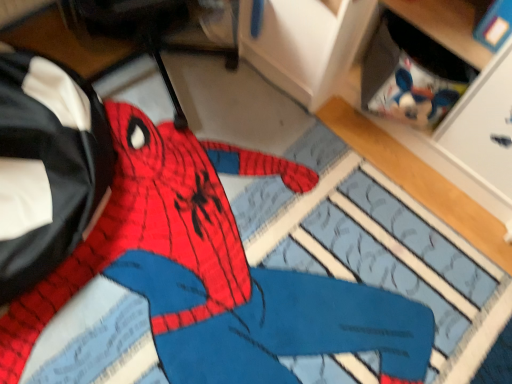
Describe the element at coordinates (213, 274) in the screenshot. I see `knitted fabric spiderman at center` at that location.

Where is `knitted fabric spiderman at center`? This screenshot has height=384, width=512. knitted fabric spiderman at center is located at coordinates (213, 274).

Locate an element on the screen. This screenshot has height=384, width=512. black leather messenger bag at left is located at coordinates (46, 166).

This screenshot has height=384, width=512. What do you see at coordinates (46, 166) in the screenshot?
I see `black leather messenger bag at left` at bounding box center [46, 166].

Locate an element on the screen. This screenshot has height=384, width=512. knitted fabric spiderman at center is located at coordinates click(213, 274).

Which is more to the right, knitted fabric spiderman at center or black leather messenger bag at left?

Positioned to the right is knitted fabric spiderman at center.

Which object is further away from the camera taking this photo, knitted fabric spiderman at center or black leather messenger bag at left?

Positioned behind is black leather messenger bag at left.

Does point (119, 261) lie in front of point (5, 135)?

No, (119, 261) is further to viewer.

From the image's perspective, is knitted fabric spiderman at center located beneath black leather messenger bag at left?

Yes.

From a real-world perspective, which object stands above the other?

From a 3D spatial view, black leather messenger bag at left is above.

Can you confirm if knitted fabric spiderman at center is thinner than black leather messenger bag at left?

No.

Based on the photo, who is shorter, knitted fabric spiderman at center or black leather messenger bag at left?

knitted fabric spiderman at center.

Which of these two, knitted fabric spiderman at center or black leather messenger bag at left, is bigger?

black leather messenger bag at left is bigger.

Is knitted fabric spiderman at center inside or outside of black leather messenger bag at left?

knitted fabric spiderman at center is outside black leather messenger bag at left.

In the scene shown: Is knitted fabric spiderman at center not near black leather messenger bag at left?

No, knitted fabric spiderman at center is not far from black leather messenger bag at left.

Is knitted fabric spiderman at center oriented towards black leather messenger bag at left?

No.

In the scene shown: Can you tell me how much knitted fabric spiderman at center and black leather messenger bag at left differ in facing direction?

The angular difference between knitted fabric spiderman at center and black leather messenger bag at left is 1.49 degrees.

At what (x,y) coordinates should I click in order to perform the action: click on messenger bag on the left side of knitted fabric spiderman at center. Please return your answer as a coordinate pair (x, y). The height and width of the screenshot is (384, 512). Looking at the image, I should click on (46, 166).

Considering the positions of objects black leather messenger bag at left and knitted fabric spiderman at center in the image provided, who is more to the right, black leather messenger bag at left or knitted fabric spiderman at center?

knitted fabric spiderman at center is more to the right.

Which is in front, black leather messenger bag at left or knitted fabric spiderman at center?

Positioned in front is knitted fabric spiderman at center.

Between point (85, 221) and point (213, 378), which one is positioned behind?

The point (85, 221) is more distant.

From the picture: From the image's perspective, between black leather messenger bag at left and knitted fabric spiderman at center, who is located below?

knitted fabric spiderman at center, from the image's perspective.

From a real-world perspective, relative to knitted fabric spiderman at center, is black leather messenger bag at left vertically above or below?

In terms of real-world spatial position, black leather messenger bag at left is above knitted fabric spiderman at center.

Considering the relative sizes of black leather messenger bag at left and knitted fabric spiderman at center in the image provided, is black leather messenger bag at left wider than knitted fabric spiderman at center?

No, black leather messenger bag at left is not wider than knitted fabric spiderman at center.

In the scene shown: Considering the sizes of black leather messenger bag at left and knitted fabric spiderman at center in the image, is black leather messenger bag at left taller or shorter than knitted fabric spiderman at center?

Clearly, black leather messenger bag at left is taller compared to knitted fabric spiderman at center.

Between black leather messenger bag at left and knitted fabric spiderman at center, which one has larger size?

black leather messenger bag at left.

Is knitted fabric spiderman at center located within black leather messenger bag at left?

No, knitted fabric spiderman at center is located outside of black leather messenger bag at left.

Are black leather messenger bag at left and knitted fabric spiderman at center beside each other?

There is a gap between black leather messenger bag at left and knitted fabric spiderman at center.

Is black leather messenger bag at left oriented towards knitted fabric spiderman at center?

Yes, black leather messenger bag at left is aimed at knitted fabric spiderman at center.

Looking at this image, what's the angular difference between black leather messenger bag at left and knitted fabric spiderman at center's facing directions?

1.49 degrees.

Where is `messenger bag behind the knitted fabric spiderman at center`? messenger bag behind the knitted fabric spiderman at center is located at coordinates (46, 166).

This screenshot has width=512, height=384. I want to click on person in front of the black leather messenger bag at left, so click(x=213, y=274).

Find the location of a particular element. The width and height of the screenshot is (512, 384). messenger bag above the knitted fabric spiderman at center (from a real-world perspective) is located at coordinates (46, 166).